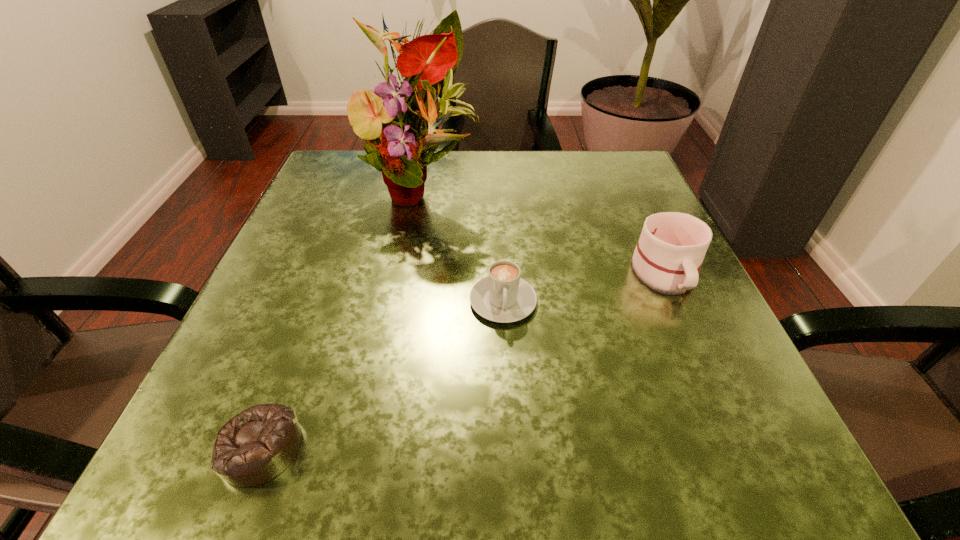
At what (x,y) coordinates should I click in order to perform the action: click on bouquet. Please return your answer as a coordinate pair (x, y). This screenshot has height=540, width=960. Looking at the image, I should click on (428, 63).

At what (x,y) coordinates should I click in order to perform the action: click on the tallest object. Please return your answer as a coordinate pair (x, y). This screenshot has height=540, width=960. Looking at the image, I should click on (428, 63).

At what (x,y) coordinates should I click in order to perform the action: click on mug. Please return your answer as a coordinate pair (x, y). This screenshot has width=960, height=540. Looking at the image, I should click on (668, 256).

At what (x,y) coordinates should I click in order to perform the action: click on the rightmost object. Please return your answer as a coordinate pair (x, y). This screenshot has width=960, height=540. Looking at the image, I should click on (668, 256).

The height and width of the screenshot is (540, 960). I want to click on cappuccino, so click(504, 297).

Locate an element on the screen. The height and width of the screenshot is (540, 960). beanbag is located at coordinates (258, 444).

Identify the location of the nearest object. This screenshot has height=540, width=960. (258, 444).

At what (x,y) coordinates should I click in order to perform the action: click on vacant space located 0.340m on the front-facing side of the tallest object. Please return your answer as a coordinate pair (x, y). Looking at the image, I should click on (389, 366).

Where is `free region located on the side with the handle of the rightmost object`? This screenshot has height=540, width=960. free region located on the side with the handle of the rightmost object is located at coordinates (719, 393).

I want to click on blank space located 0.200m to the right of the cappuccino, so click(x=511, y=448).